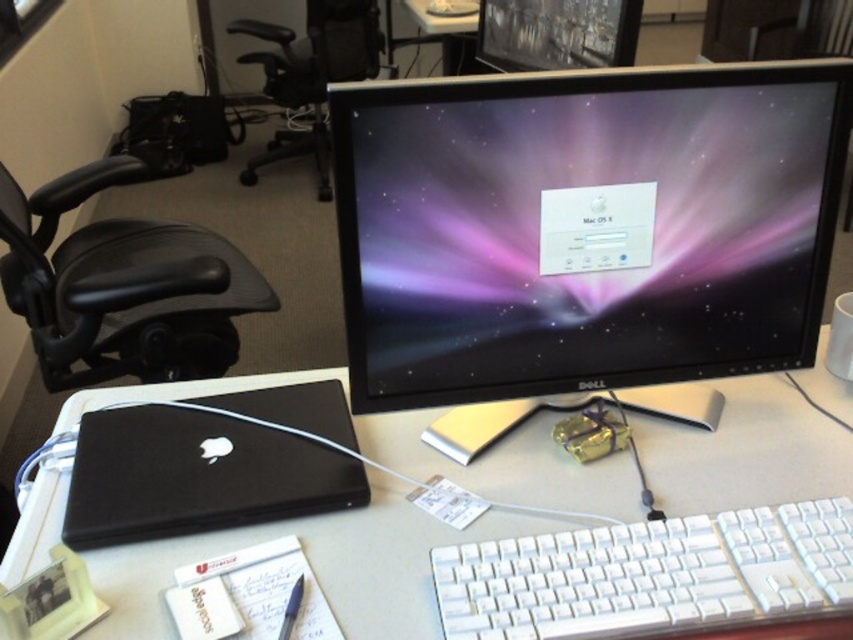
What is the object located at the coordinates point [650,573]?

The object located at point [650,573] is the white plastic keyboard at lower center.

You are standing in front of the desk and want to reach both points on the desk. Which point, point (512, 76) or point (51, 316), is closer to you?

Point (512, 76) is closer to you than point (51, 316) because it is closer to the camera.